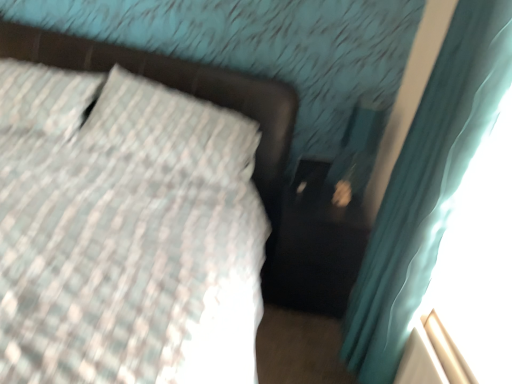
Question: Can you confirm if matte black bed frame at upper left is shorter than teal fabric curtain at right?

Choices:
 (A) yes
 (B) no

Answer: (A)

Question: Is matte black bed frame at upper left aimed at teal fabric curtain at right?

Choices:
 (A) yes
 (B) no

Answer: (B)

Question: Is matte black bed frame at upper left positioned far away from teal fabric curtain at right?

Choices:
 (A) yes
 (B) no

Answer: (A)

Question: From a real-world perspective, is matte black bed frame at upper left on teal fabric curtain at right?

Choices:
 (A) yes
 (B) no

Answer: (B)

Question: Is the position of matte black bed frame at upper left more distant than that of teal fabric curtain at right?

Choices:
 (A) yes
 (B) no

Answer: (A)

Question: Does matte black bed frame at upper left have a smaller size compared to teal fabric curtain at right?

Choices:
 (A) no
 (B) yes

Answer: (A)

Question: Is teal fabric curtain at right oriented towards matte black bed frame at upper left?

Choices:
 (A) no
 (B) yes

Answer: (A)

Question: Considering the relative sizes of teal fabric curtain at right and matte black bed frame at upper left in the image provided, is teal fabric curtain at right taller than matte black bed frame at upper left?

Choices:
 (A) no
 (B) yes

Answer: (B)

Question: Considering the relative sizes of teal fabric curtain at right and matte black bed frame at upper left in the image provided, is teal fabric curtain at right bigger than matte black bed frame at upper left?

Choices:
 (A) yes
 (B) no

Answer: (B)

Question: Is teal fabric curtain at right located outside matte black bed frame at upper left?

Choices:
 (A) yes
 (B) no

Answer: (A)

Question: From a real-world perspective, is teal fabric curtain at right located higher than matte black bed frame at upper left?

Choices:
 (A) yes
 (B) no

Answer: (A)

Question: From the image's perspective, is teal fabric curtain at right over matte black bed frame at upper left?

Choices:
 (A) no
 (B) yes

Answer: (A)

Question: Is teal fabric curtain at right taller or shorter than matte black bed frame at upper left?

Choices:
 (A) short
 (B) tall

Answer: (B)